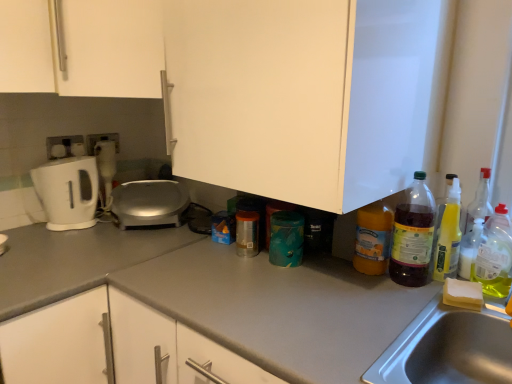
Where is `vacant area in front of translucent plastic spray bottle at right, which is the 3th bottle in left-to-right order`? vacant area in front of translucent plastic spray bottle at right, which is the 3th bottle in left-to-right order is located at coordinates (439, 299).